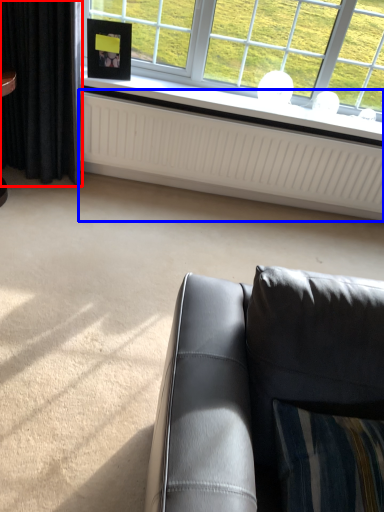
Question: Which object is further to the camera taking this photo, curtain (highlighted by a red box) or radiator (highlighted by a blue box)?

Choices:
 (A) curtain
 (B) radiator

Answer: (B)